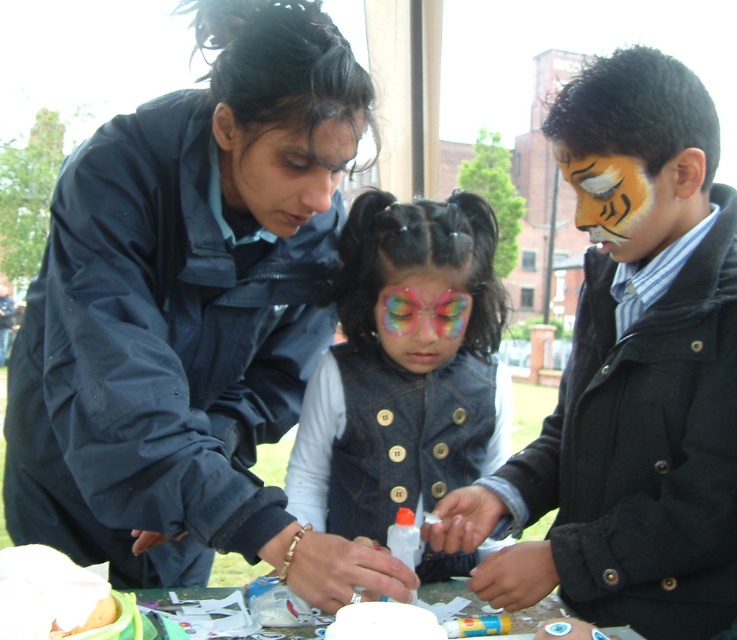
You are a photographer taking a picture of the matte black jacket at center and the glittery rainbow face paint at center. Which object will appear larger in the photo?

The matte black jacket at center will appear larger in the photo because it is closer to the viewer than the glittery rainbow face paint at center.

You are a photographer trying to capture the scene of the woman and the young girl. You need to ensure both the denim vest at center and the matte orange tiger face paint at center are clearly visible in the photo. Given their sizes, which object might require you to adjust your camera focus more carefully to ensure clarity?

The matte orange tiger face paint at center is smaller in size than the denim vest at center, so it might require more careful focus adjustment to ensure clarity in the photo.